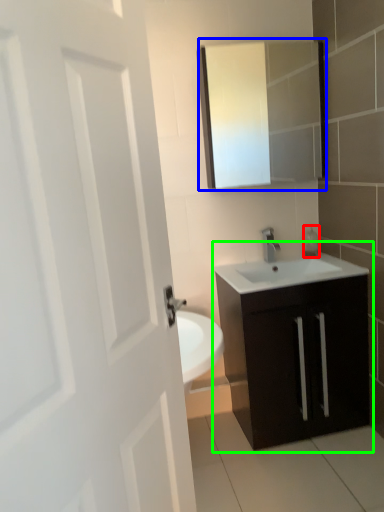
Question: Which object is positioned closest to soap dispenser (highlighted by a red box)? Select from medicine cabinet (highlighted by a blue box) and bathroom cabinet (highlighted by a green box).

Choices:
 (A) medicine cabinet
 (B) bathroom cabinet

Answer: (B)